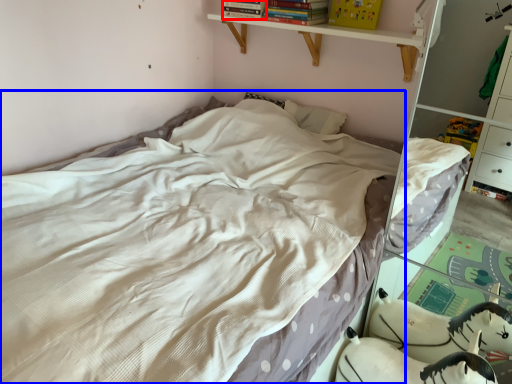
Question: Which point is closer to the camera, book (highlighted by a red box) or bed (highlighted by a blue box)?

Choices:
 (A) book
 (B) bed

Answer: (B)